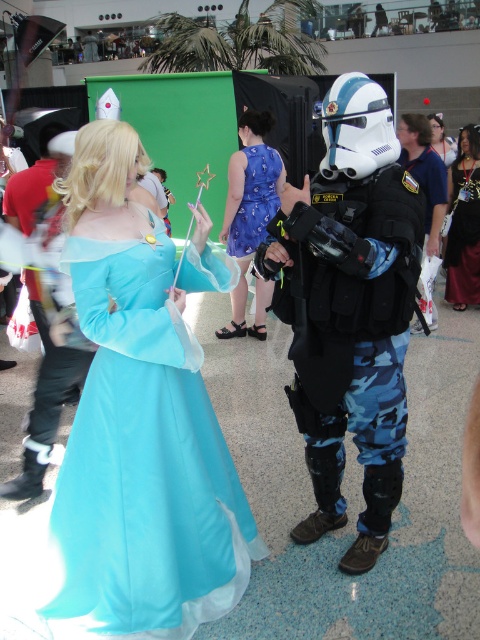
Is camo-patterned armor at center thinner than matte black hair at upper center?

Yes.

Is camo-patterned armor at center above matte black hair at upper center?

Actually, camo-patterned armor at center is below matte black hair at upper center.

Describe the element at coordinates (349, 308) in the screenshot. The width and height of the screenshot is (480, 640). I see `camo-patterned armor at center` at that location.

Identify the location of camo-patterned armor at center. (349, 308).

Which is behind, point (255, 168) or point (273, 154)?

Point (273, 154)

Is blue satin dress at center bigger than blue printed fabric dress at center?

Yes.

Does point (242, 182) lie behind point (232, 237)?

No.

The height and width of the screenshot is (640, 480). In order to click on blue satin dress at center in this screenshot , I will do `click(251, 216)`.

Between point (264, 168) and point (436, 204), which one is positioned behind?

The point (264, 168) is more distant.

Which of these two, blue satin dress at center or camouflage pants at center, stands taller?

Standing taller between the two is blue satin dress at center.

Where is `blue satin dress at center`? blue satin dress at center is located at coordinates (251, 216).

At what (x,y) coordinates should I click in order to perform the action: click on blue satin dress at center. Please return your answer as a coordinate pair (x, y). The width and height of the screenshot is (480, 640). Looking at the image, I should click on (251, 216).